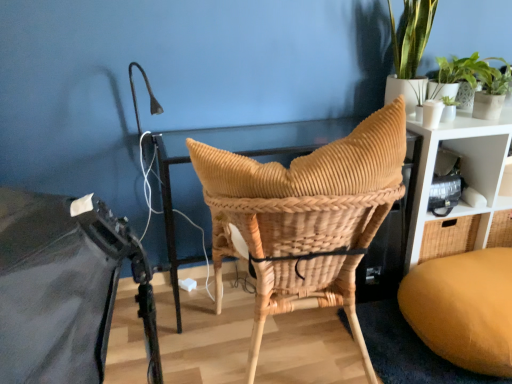
Question: Can you confirm if white matte shelf at right, the second shelf in the bottom-to-top sequence, is bigger than natural woven chair at center?

Choices:
 (A) no
 (B) yes

Answer: (A)

Question: Can you confirm if white matte shelf at right, the first shelf viewed from the top, is wider than natural woven chair at center?

Choices:
 (A) yes
 (B) no

Answer: (B)

Question: Is white matte shelf at right, the first shelf viewed from the top, shorter than natural woven chair at center?

Choices:
 (A) yes
 (B) no

Answer: (A)

Question: Is natural woven chair at center located within white matte shelf at right, the second shelf in the bottom-to-top sequence?

Choices:
 (A) no
 (B) yes

Answer: (A)

Question: Considering the relative positions of white matte shelf at right, the first shelf viewed from the top, and natural woven chair at center in the image provided, is white matte shelf at right, the first shelf viewed from the top, to the right of natural woven chair at center from the viewer's perspective?

Choices:
 (A) yes
 (B) no

Answer: (A)

Question: From the image's perspective, is green leafy plant at upper right, the 1th houseplant when ordered from right to left, located above or below white matte shelf at right, the first shelf viewed from the top?

Choices:
 (A) above
 (B) below

Answer: (A)

Question: Is point [501, 82] positioned closer to the camera than point [489, 145]?

Choices:
 (A) closer
 (B) farther

Answer: (A)

Question: Considering their positions, is green leafy plant at upper right, the 1th houseplant when ordered from right to left, located in front of or behind white matte shelf at right, the second shelf in the bottom-to-top sequence?

Choices:
 (A) behind
 (B) front

Answer: (A)

Question: Which is correct: green leafy plant at upper right, the 1th houseplant when ordered from right to left, is inside white matte shelf at right, the first shelf viewed from the top, or outside of it?

Choices:
 (A) inside
 (B) outside

Answer: (B)

Question: Is point (422, 153) closer or farther from the camera than point (460, 61)?

Choices:
 (A) closer
 (B) farther

Answer: (A)

Question: In the image, is white woven shelf at upper right, marked as the second shelf in a top-to-bottom arrangement, on the left side or the right side of green leafy plant at upper right, which appears as the second houseplant when viewed from the left?

Choices:
 (A) left
 (B) right

Answer: (A)

Question: Considering the positions of white woven shelf at upper right, marked as the second shelf in a top-to-bottom arrangement, and green leafy plant at upper right, the 1th houseplant when ordered from right to left, in the image, is white woven shelf at upper right, marked as the second shelf in a top-to-bottom arrangement, wider or thinner than green leafy plant at upper right, the 1th houseplant when ordered from right to left,?

Choices:
 (A) wide
 (B) thin

Answer: (A)

Question: Looking at the image, does white woven shelf at upper right, marked as the second shelf in a top-to-bottom arrangement, seem bigger or smaller compared to green leafy plant at upper right, which appears as the second houseplant when viewed from the left?

Choices:
 (A) big
 (B) small

Answer: (A)

Question: Based on their positions, is velvet mustard bean bag at lower right located to the left or right of woven rattan basket at center?

Choices:
 (A) right
 (B) left

Answer: (A)

Question: Looking at the image, does velvet mustard bean bag at lower right seem bigger or smaller compared to woven rattan basket at center?

Choices:
 (A) big
 (B) small

Answer: (A)